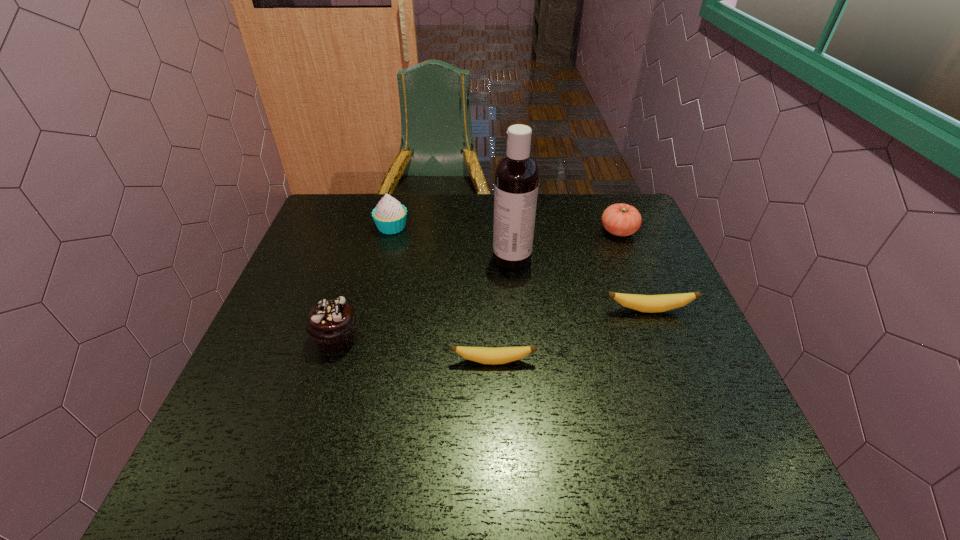
In the current image, all bananas are evenly spaced. To maintain this equal spacing, where should an additional banana be placed on the left? Please point out a free spot. Please provide its 2D coordinates. Your answer should be formatted as a tuple, i.e. [(x, y)], where the tuple contains the x and y coordinates of a point satisfying the conditions above.

[(296, 426)]